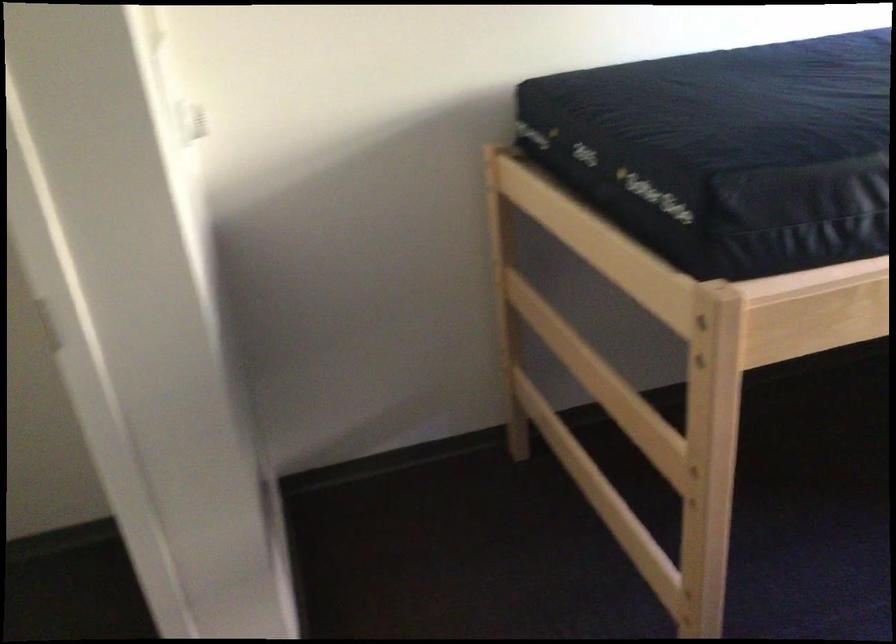
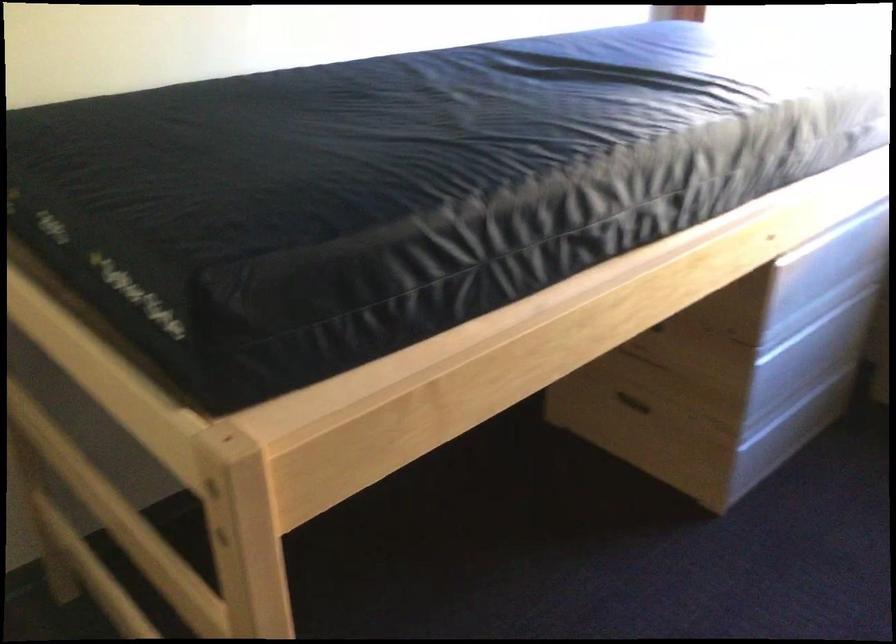
What movement of the cameraman would produce the second image?

The movement direction of the cameraman is right, forward.